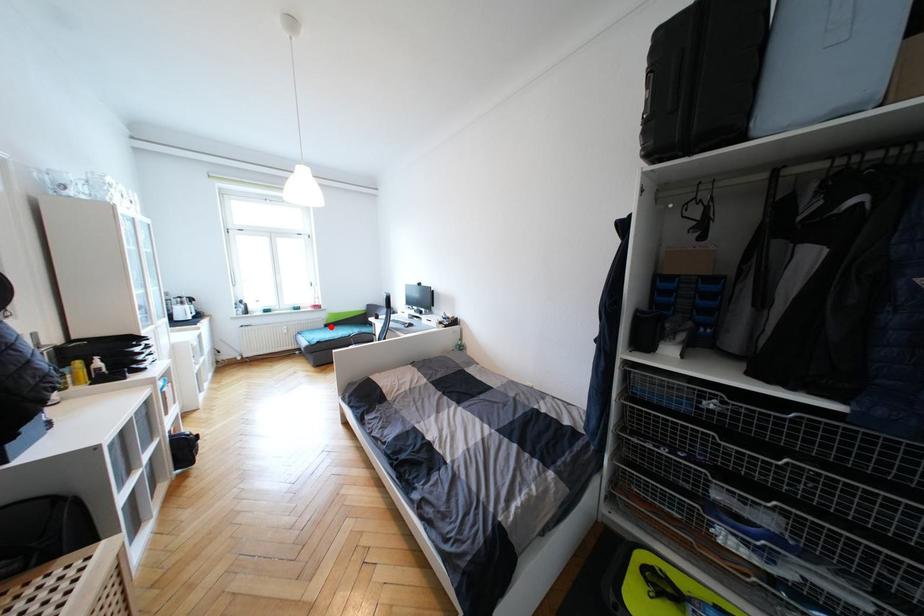
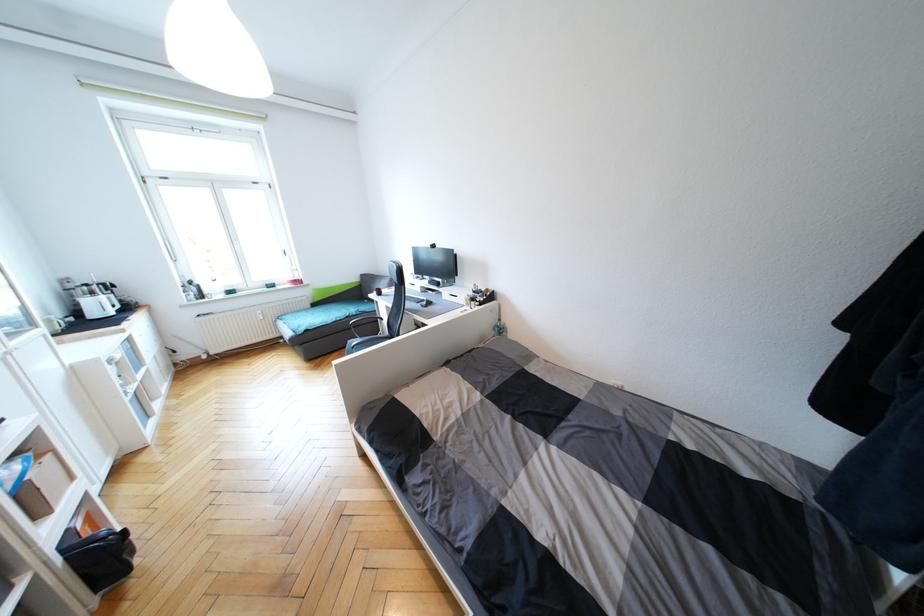
Question: I am providing you with two images of the same scene from different viewpoints. A red point is shown in image1. For the corresponding object point in image2, is it positioned nearer or farther from the camera?

Choices:
 (A) Nearer
 (B) Farther

Answer: (A)